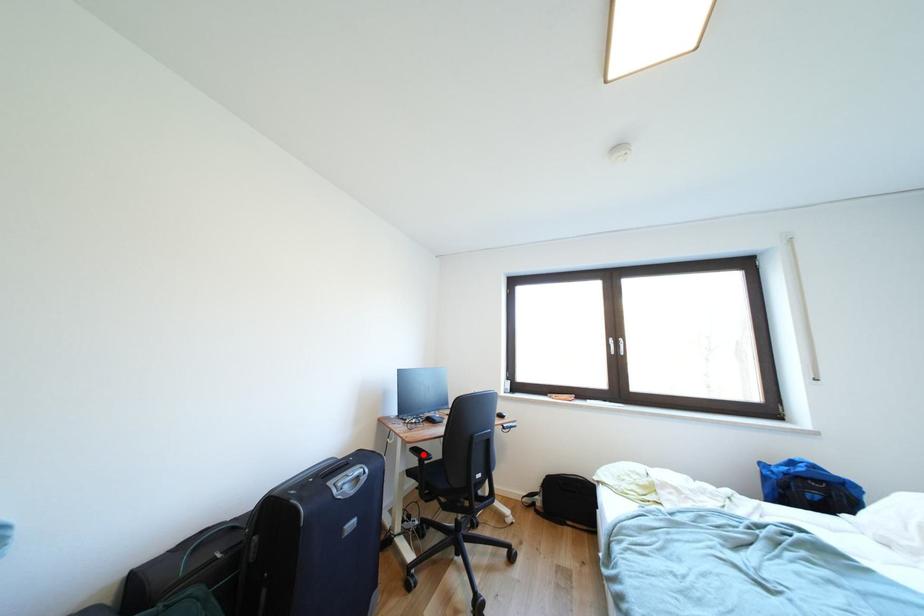
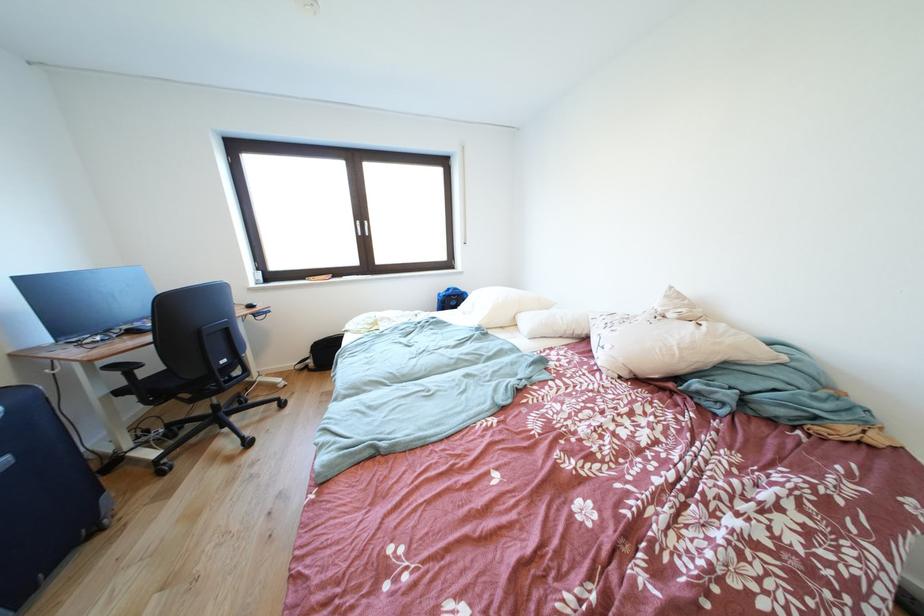
Question: I am providing you with two images of the same scene from different viewpoints. Given a red point in image1, look at the same physical point in image2. Is it:

Choices:
 (A) Closer to the viewpoint
 (B) Farther from the viewpoint

Answer: (A)